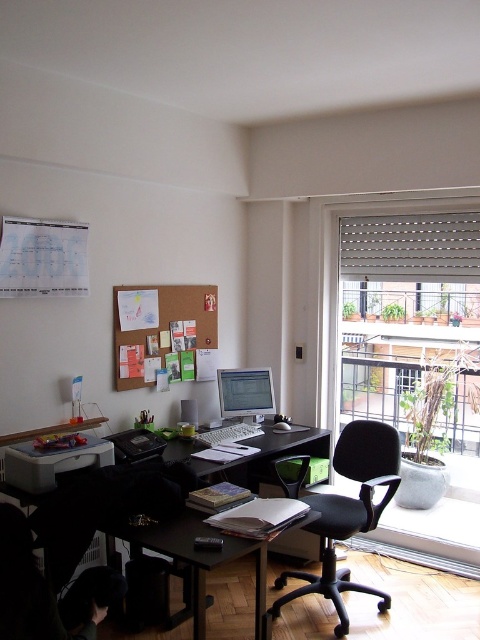
Can you confirm if matte white printer at lower left is positioned to the left of matte silver desktop computer at center?

Yes, matte white printer at lower left is to the left of matte silver desktop computer at center.

This screenshot has width=480, height=640. Find the location of `matte white printer at lower left`. matte white printer at lower left is located at coordinates [x=51, y=461].

Between point (12, 472) and point (260, 369), which one is positioned behind?

Point (260, 369)

At what (x,y) coordinates should I click in order to perform the action: click on matte white printer at lower left. Please return your answer as a coordinate pair (x, y). The height and width of the screenshot is (640, 480). Looking at the image, I should click on (51, 461).

Does point (343, 525) lie in front of point (148, 536)?

No, (343, 525) is further to viewer.

Is black plastic swivel chair at center bigger than black plastic table at center?

Yes, black plastic swivel chair at center is bigger than black plastic table at center.

Who is more distant from viewer, (x=297, y=486) or (x=181, y=444)?

Positioned behind is point (x=181, y=444).

The width and height of the screenshot is (480, 640). I want to click on black plastic swivel chair at center, so click(x=348, y=513).

In the scene shown: Between black plastic swivel chair at center and white fabric blind at upper right, which one appears on the left side from the viewer's perspective?

Positioned to the left is black plastic swivel chair at center.

Is black plastic swivel chair at center shorter than white fabric blind at upper right?

Incorrect, black plastic swivel chair at center's height does not fall short of white fabric blind at upper right's.

Measure the distance between point (x=298, y=593) and camera.

Point (x=298, y=593) is 3.09 meters away from camera.

Identify the location of black plastic swivel chair at center. (348, 513).